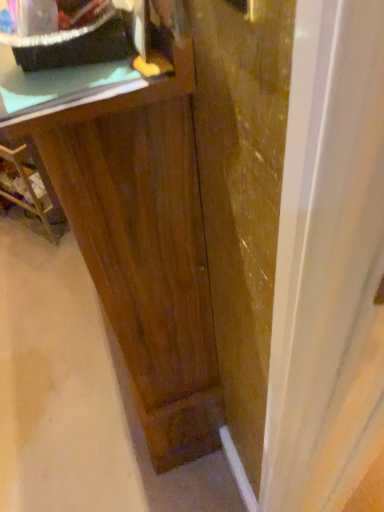
The height and width of the screenshot is (512, 384). In order to click on transparent glass door at center in this screenshot , I will do `click(328, 264)`.

What do you see at coordinates (74, 44) in the screenshot? I see `matte black tray at upper left` at bounding box center [74, 44].

Locate an element on the screen. This screenshot has width=384, height=512. transparent glass door at center is located at coordinates (328, 264).

Based on the photo, is transparent glass door at center facing away from dark wood vanity at center?

No.

Can you confirm if transparent glass door at center is taller than dark wood vanity at center?

Correct, transparent glass door at center is much taller as dark wood vanity at center.

Is there a large distance between transparent glass door at center and dark wood vanity at center?

Actually, transparent glass door at center and dark wood vanity at center are a little close together.

Based on the photo, from a real-world perspective, between transparent glass door at center and dark wood vanity at center, who is vertically higher?

In real-world perspective, transparent glass door at center is above.

Could you measure the distance between green matte counter top at upper left and metallic gold door handle at upper right?

The distance of green matte counter top at upper left from metallic gold door handle at upper right is 18.59 centimeters.

From the image's perspective, which one is positioned lower, green matte counter top at upper left or metallic gold door handle at upper right?

From the image's view, metallic gold door handle at upper right is below.

Can we say green matte counter top at upper left lies outside metallic gold door handle at upper right?

Yes.

Locate an element on the screen. This screenshot has height=512, width=384. door handle above the green matte counter top at upper left (from a real-world perspective) is located at coordinates (245, 8).

Is dark wood vanity at center turned away from matte black tray at upper left?

dark wood vanity at center does not have its back to matte black tray at upper left.

Considering the sizes of dark wood vanity at center and matte black tray at upper left in the image, is dark wood vanity at center bigger or smaller than matte black tray at upper left?

In the image, dark wood vanity at center appears to be larger than matte black tray at upper left.

Is dark wood vanity at center not near matte black tray at upper left?

That's not correct — dark wood vanity at center is a little close to matte black tray at upper left.

Considering the sizes of objects dark wood vanity at center and matte black tray at upper left in the image provided, who is taller, dark wood vanity at center or matte black tray at upper left?

Standing taller between the two is dark wood vanity at center.

Considering the positions of points (51, 213) and (347, 167), is point (51, 213) closer to camera compared to point (347, 167)?

No, (51, 213) is further to viewer.

Based on the photo, considering the positions of objects dark wood cabinet at left and transparent glass door at center in the image provided, who is more to the right, dark wood cabinet at left or transparent glass door at center?

Positioned to the right is transparent glass door at center.

Is dark wood cabinet at left not inside transparent glass door at center?

Absolutely, dark wood cabinet at left is external to transparent glass door at center.

Does dark wood vanity at center have a lesser height compared to metallic gold door handle at upper right?

No.

Is dark wood vanity at center spatially inside metallic gold door handle at upper right, or outside of it?

dark wood vanity at center exists outside the volume of metallic gold door handle at upper right.

Is dark wood vanity at center turned away from metallic gold door handle at upper right?

dark wood vanity at center is not turned away from metallic gold door handle at upper right.

From a real-world perspective, who is located lower, dark wood vanity at center or metallic gold door handle at upper right?

dark wood vanity at center, from a real-world perspective.

Does metallic gold door handle at upper right turn towards transparent glass door at center?

No, metallic gold door handle at upper right is not aimed at transparent glass door at center.

Would you say transparent glass door at center is part of metallic gold door handle at upper right's contents?

No, transparent glass door at center is located outside of metallic gold door handle at upper right.

Between metallic gold door handle at upper right and transparent glass door at center, which one has less height?

Standing shorter between the two is metallic gold door handle at upper right.

In terms of width, does metallic gold door handle at upper right look wider or thinner when compared to transparent glass door at center?

Considering their sizes, metallic gold door handle at upper right looks slimmer than transparent glass door at center.

Considering the sizes of objects dark wood vanity at center and green matte counter top at upper left in the image provided, who is bigger, dark wood vanity at center or green matte counter top at upper left?

With larger size is dark wood vanity at center.

In the scene shown: Can you confirm if dark wood vanity at center is shorter than green matte counter top at upper left?

In fact, dark wood vanity at center may be taller than green matte counter top at upper left.

From a real-world perspective, is dark wood vanity at center positioned above or below green matte counter top at upper left?

dark wood vanity at center is below green matte counter top at upper left.

Identify the location of vanity on the left side of transparent glass door at center. (144, 246).

Identify the location of door handle on the right of the green matte counter top at upper left. Image resolution: width=384 pixels, height=512 pixels. (245, 8).

Which object lies nearer to the anchor point matte black tray at upper left, dark wood vanity at center or dark wood cabinet at left?

The object closer to matte black tray at upper left is dark wood vanity at center.

Looking at the image, which one is located closer to green matte counter top at upper left, dark wood vanity at center or dark wood cabinet at left?

The object closer to green matte counter top at upper left is dark wood vanity at center.

From the image, which object appears to be nearer to dark wood vanity at center, metallic gold door handle at upper right or dark wood cabinet at left?

metallic gold door handle at upper right is closer to dark wood vanity at center.

Estimate the real-world distances between objects in this image. Which object is further from dark wood cabinet at left, transparent glass door at center or dark wood vanity at center?

The object further to dark wood cabinet at left is transparent glass door at center.

When comparing their distances from transparent glass door at center, does green matte counter top at upper left or metallic gold door handle at upper right seem further?

Among the two, green matte counter top at upper left is located further to transparent glass door at center.

Which object lies further to the anchor point metallic gold door handle at upper right, matte black tray at upper left or dark wood vanity at center?

The object further to metallic gold door handle at upper right is dark wood vanity at center.

Which object lies further to the anchor point metallic gold door handle at upper right, transparent glass door at center or dark wood vanity at center?

The object further to metallic gold door handle at upper right is dark wood vanity at center.

Looking at the image, which one is located further to dark wood cabinet at left, green matte counter top at upper left or matte black tray at upper left?

matte black tray at upper left is positioned further to the anchor dark wood cabinet at left.

The width and height of the screenshot is (384, 512). Identify the location of vanity that lies between green matte counter top at upper left and transparent glass door at center from top to bottom. (144, 246).

The width and height of the screenshot is (384, 512). Find the location of `counter top between matte black tray at upper left and metallic gold door handle at upper right`. counter top between matte black tray at upper left and metallic gold door handle at upper right is located at coordinates (85, 90).

In order to click on vanity between metallic gold door handle at upper right and dark wood cabinet at left along the z-axis in this screenshot , I will do `click(144, 246)`.

Locate an element on the screen. The height and width of the screenshot is (512, 384). counter top between dark wood vanity at center and metallic gold door handle at upper right in the horizontal direction is located at coordinates (85, 90).